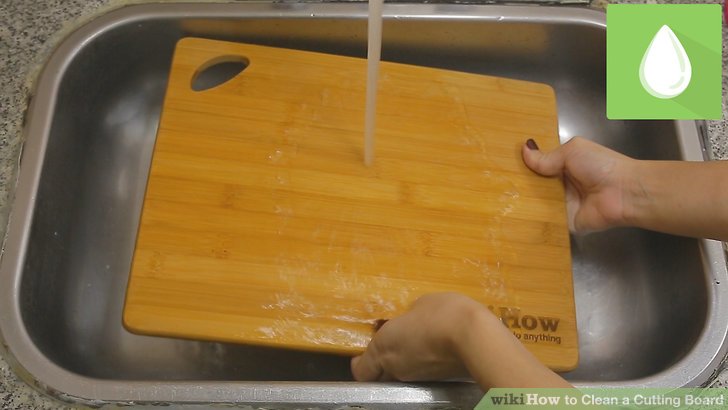
At what (x,y) coordinates should I click in order to perform the action: click on hold in cutting board. Please return your answer as a coordinate pair (x, y). This screenshot has height=410, width=728. Looking at the image, I should click on (218, 78).